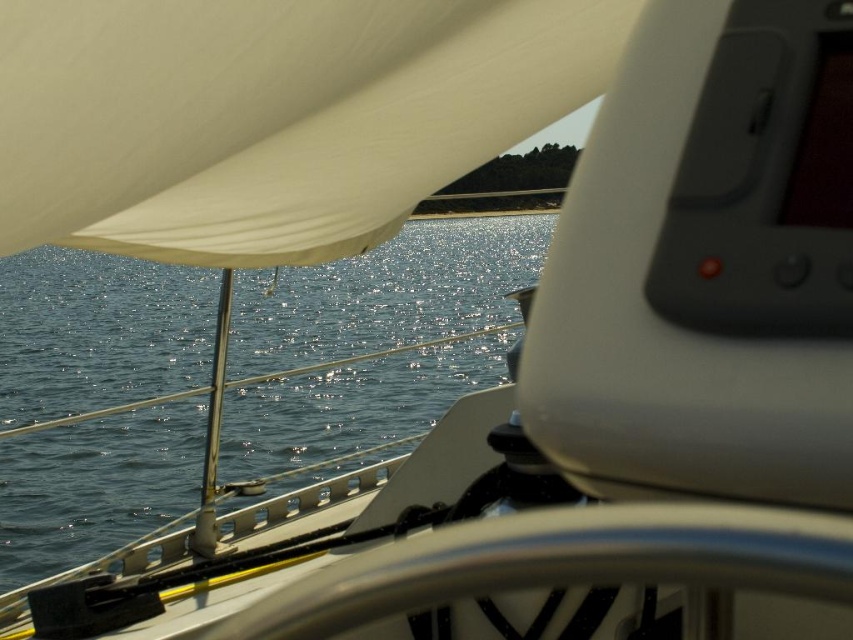
Is white matte sail at upper left above glistening blue water at center?

Yes, white matte sail at upper left is above glistening blue water at center.

Locate an element on the screen. The height and width of the screenshot is (640, 853). white matte sail at upper left is located at coordinates (271, 115).

Does point (473, 99) lie behind point (477, 326)?

No, it is not.

Find the location of a particular element. The width and height of the screenshot is (853, 640). white matte sail at upper left is located at coordinates (271, 115).